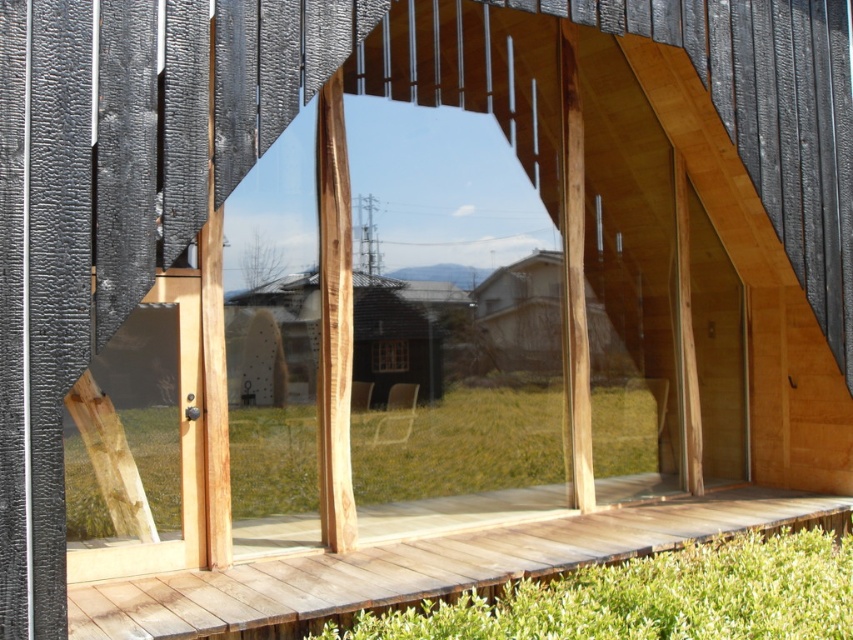
Identify the location of transparent wood door at center. (274, 348).

Measure the distance between transparent wood door at center and camera.

A distance of 5.12 meters exists between transparent wood door at center and camera.

Where is `transparent wood door at center`? transparent wood door at center is located at coordinates (274, 348).

Can you confirm if transparent wood door at center is shorter than transparent glass window at center?

No, transparent wood door at center is not shorter than transparent glass window at center.

Is transparent wood door at center above transparent glass window at center?

Correct, transparent wood door at center is located above transparent glass window at center.

Where is `transparent wood door at center`? The width and height of the screenshot is (853, 640). transparent wood door at center is located at coordinates (274, 348).

Can you confirm if wooden house at center is shorter than transparent glass window at center?

No, wooden house at center is not shorter than transparent glass window at center.

Who is positioned more to the left, wooden house at center or transparent glass window at center?

transparent glass window at center is more to the left.

Is point (477, 307) farther from viewer compared to point (396, 365)?

No, it is in front of (396, 365).

Image resolution: width=853 pixels, height=640 pixels. I want to click on wooden house at center, so click(523, 312).